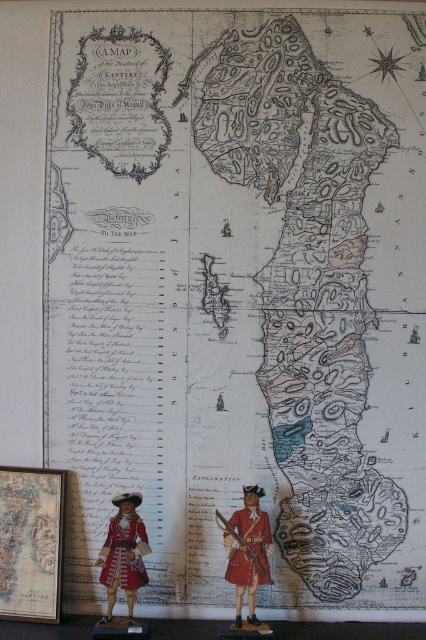
Who is lower down, shiny red uniform at center or matte red uniform at lower left?

Positioned lower is matte red uniform at lower left.

Between shiny red uniform at center and matte red uniform at lower left, which one has less height?

matte red uniform at lower left is shorter.

This screenshot has width=426, height=640. Find the location of `shiny red uniform at center`. shiny red uniform at center is located at coordinates (247, 552).

This screenshot has width=426, height=640. Find the location of `shiny red uniform at center`. shiny red uniform at center is located at coordinates (247, 552).